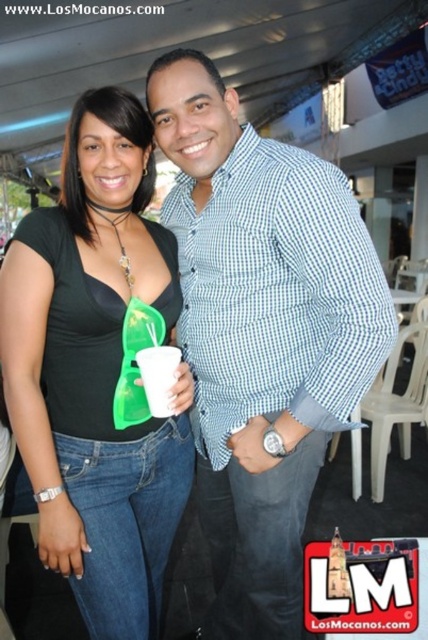
You are at a party and want to place both the black matte top at center and the white paper cup at center on a small table that can only hold one item. Which item should you choose to place on the table to maximize the space?

The black matte top at center is bigger than the white paper cup at center, so you should place the white paper cup at center on the table to maximize the space available.

You are a photographer at the event and want to take a photo focusing on the blue checkered shirt at center and the white paper cup at center. Which object should you adjust your camera to focus on first if you want to capture both in the frame without moving the subjects?

The blue checkered shirt at center is to the right of white paper cup at center, so you should focus on the white paper cup at center first to ensure both are in frame without moving the subjects.